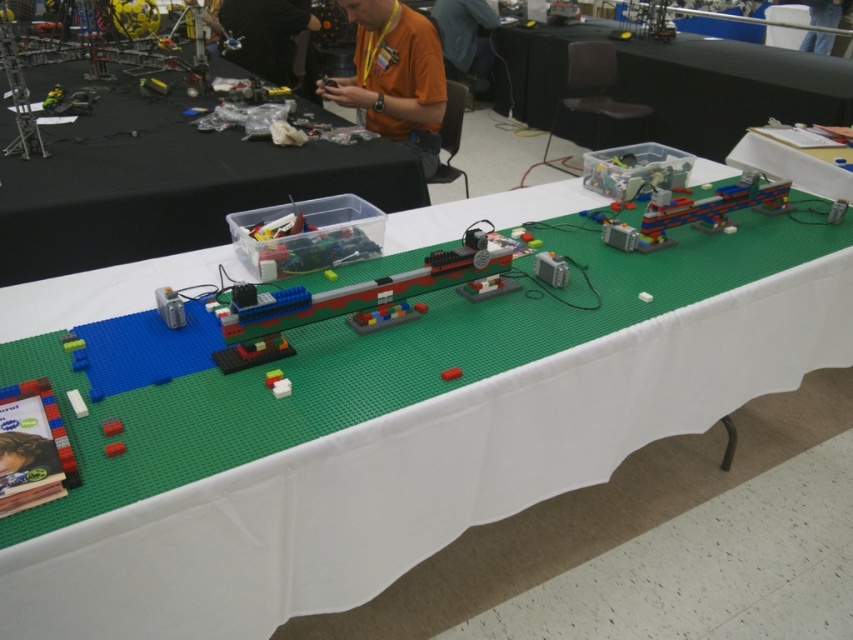
Question: Based on their relative distances, which object is farther from the denim pants at upper right?

Choices:
 (A) orange shirt at upper center
 (B) orange shirt at center

Answer: (B)

Question: Based on their relative distances, which object is farther from the orange shirt at center?

Choices:
 (A) green plastic table at center
 (B) green plastic table at upper center

Answer: (B)

Question: Can you confirm if green plastic table at center is positioned to the left of orange shirt at center?

Choices:
 (A) yes
 (B) no

Answer: (A)

Question: Is orange shirt at upper center smaller than denim pants at upper right?

Choices:
 (A) yes
 (B) no

Answer: (B)

Question: Which point is farther from the camera taking this photo?

Choices:
 (A) (660, 49)
 (B) (491, 67)
 (C) (262, 56)

Answer: (B)

Question: Is orange shirt at upper center further to camera compared to denim pants at upper right?

Choices:
 (A) yes
 (B) no

Answer: (B)